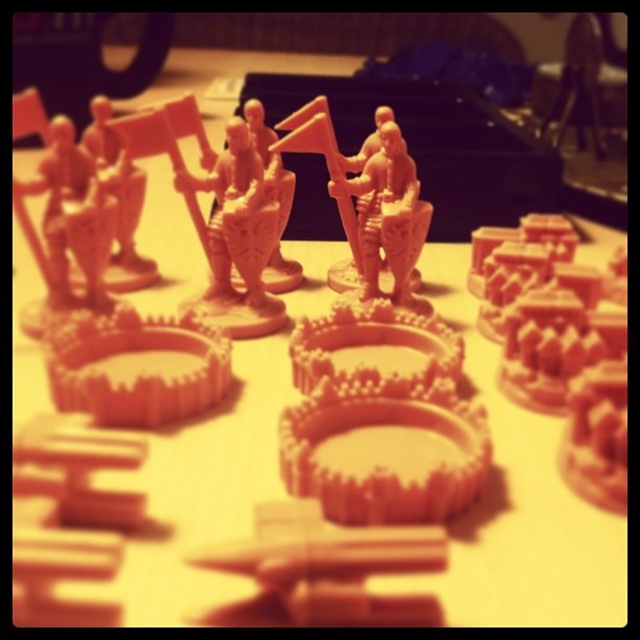
This screenshot has width=640, height=640. What are the coordinates of `matte plastic gear at center` in the screenshot? It's located at (333, 564).

Is point (387, 609) behind point (390, 148)?

No, (387, 609) is closer to viewer.

Does point (300, 536) come closer to viewer compared to point (388, 166)?

That is True.

Locate an element on the screen. matte plastic gear at center is located at coordinates (333, 564).

Who is shorter, matte plastic gear at center or matte orange gear at center?

With less height is matte plastic gear at center.

Which is behind, point (422, 563) or point (60, 355)?

The point (60, 355) is more distant.

Locate an element on the screen. This screenshot has height=640, width=640. matte plastic gear at center is located at coordinates (333, 564).

Based on the photo, between matte orange gear at center and matte orange figurine at center, which one has less height?

matte orange gear at center is shorter.

Does matte orange gear at center appear on the left side of matte orange figurine at center?

Yes, matte orange gear at center is to the left of matte orange figurine at center.

Which is behind, point (184, 394) or point (372, 225)?

The point (372, 225) is behind.

Locate an element on the screen. The width and height of the screenshot is (640, 640). matte orange gear at center is located at coordinates (138, 368).